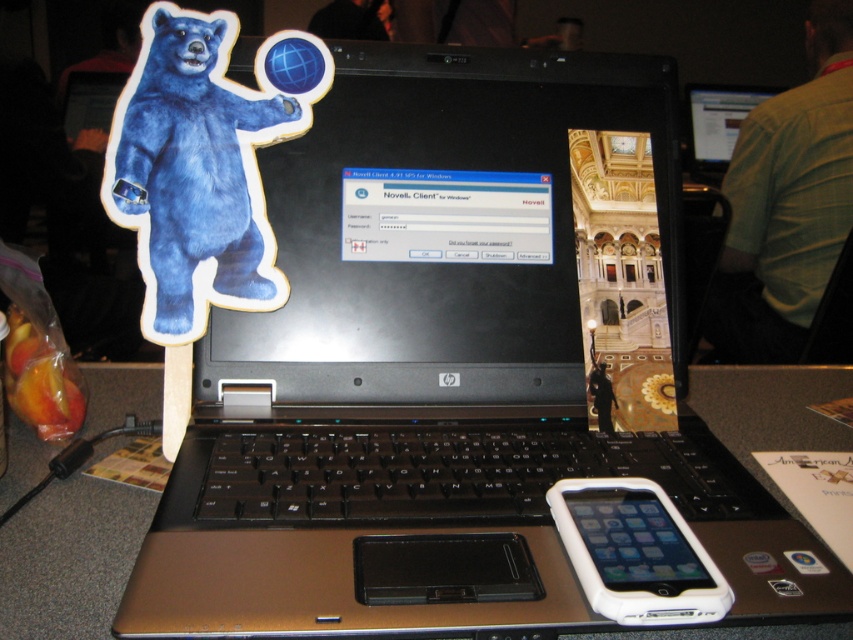
Question: Which point is farther from the camera taking this photo?

Choices:
 (A) (643, 490)
 (B) (717, 426)
 (C) (173, 264)

Answer: (B)

Question: Which object is the closest to the white plastic ipod at center?

Choices:
 (A) fuzzy blue bear at left
 (B) metallic gray table at center

Answer: (B)

Question: Which is farther from the white plastic ipod at center?

Choices:
 (A) fuzzy blue bear at left
 (B) metallic gray table at center

Answer: (A)

Question: Where is fuzzy blue bear at left located in relation to metallic gray table at center in the image?

Choices:
 (A) above
 (B) below

Answer: (A)

Question: Does metallic gray table at center appear under white plastic ipod at center?

Choices:
 (A) no
 (B) yes

Answer: (A)

Question: Is fuzzy blue bear at left positioned behind white plastic ipod at center?

Choices:
 (A) no
 (B) yes

Answer: (B)